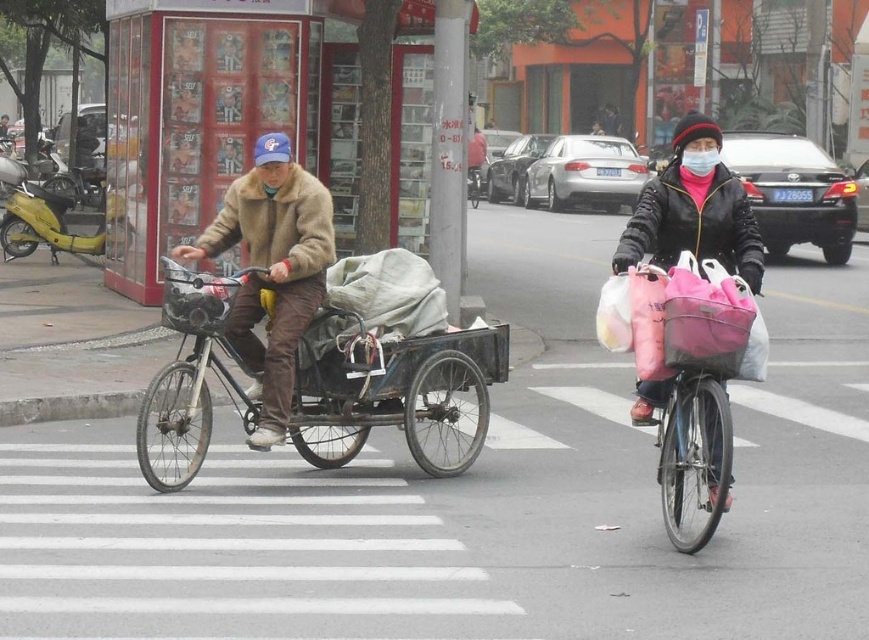
Which is in front, point (348, 424) or point (706, 116)?

Point (348, 424)

This screenshot has height=640, width=869. What are the coordinates of `rusty metal cart at center` in the screenshot? It's located at (393, 388).

You are a GUI agent. You are given a task and a screenshot of the screen. Output one action in this format:
    pyautogui.click(x=<x>, y=<y>)
    Task: Click on the rusty metal cart at center
    The width and height of the screenshot is (869, 640).
    Given the screenshot: What is the action you would take?
    pyautogui.click(x=393, y=388)

From the picture: Who is more forward, (x=456, y=381) or (x=310, y=257)?

Point (x=310, y=257)

Is point (302, 397) closer to viewer compared to point (296, 310)?

That is False.

I want to click on rusty metal cart at center, so click(x=393, y=388).

Is rusty metal cart at center positioned at the back of pink fabric bag at center?

Yes, it is behind pink fabric bag at center.

Who is more forward, (317, 403) or (710, 516)?

Point (710, 516)

I want to click on rusty metal cart at center, so click(393, 388).